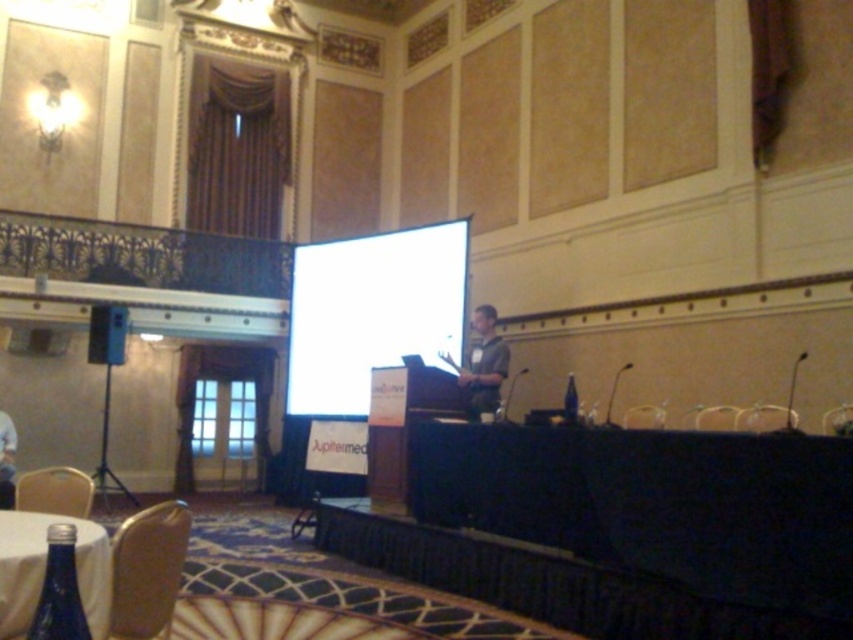
Question: Observing the image, what is the correct spatial positioning of wooden chair at lower right in reference to metallic silver chair at lower right?

Choices:
 (A) left
 (B) right

Answer: (A)

Question: Among these points, which one is nearest to the camera?

Choices:
 (A) (708, 428)
 (B) (775, 420)
 (C) (1, 605)
 (D) (144, 616)

Answer: (C)

Question: Estimate the real-world distances between objects in this image. Which object is closer to the metallic speaker at left?

Choices:
 (A) clear glass bottle at lower left
 (B) metallic gold chair at lower left
 (C) green fabric shirt at center
 (D) white glossy projection screen at center

Answer: (D)

Question: Which point appears closest to the camera in this image?

Choices:
 (A) (1, 506)
 (B) (425, 248)

Answer: (A)

Question: Does metallic gold chair at lower left have a lesser width compared to clear glass bottle at lower left?

Choices:
 (A) yes
 (B) no

Answer: (A)

Question: Is green fabric shirt at center smaller than smooth white hair at lower left?

Choices:
 (A) no
 (B) yes

Answer: (B)